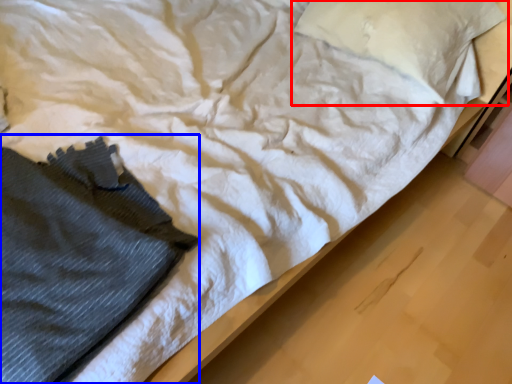
Question: Which of the following is the farthest to the observer, pillow (highlighted by a red box) or clothing (highlighted by a blue box)?

Choices:
 (A) pillow
 (B) clothing

Answer: (A)